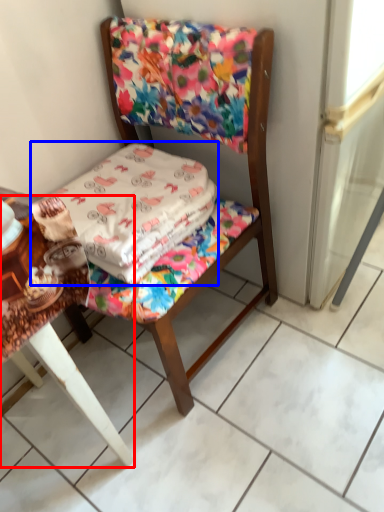
Question: Which of the following is the closest to the observer, table (highlighted by a red box) or blanket (highlighted by a blue box)?

Choices:
 (A) table
 (B) blanket

Answer: (A)